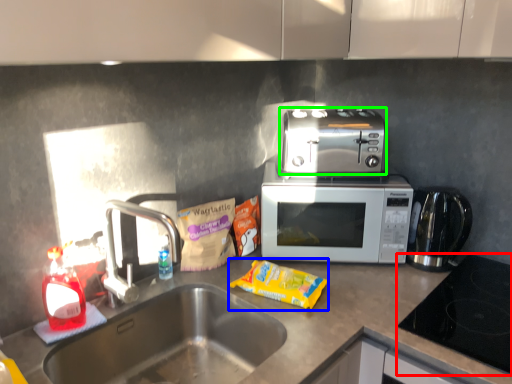
Question: Which object is positioned closest to gas stove (highlighted by a red box)? Select from snack (highlighted by a blue box) and toaster (highlighted by a green box).

Choices:
 (A) snack
 (B) toaster

Answer: (A)